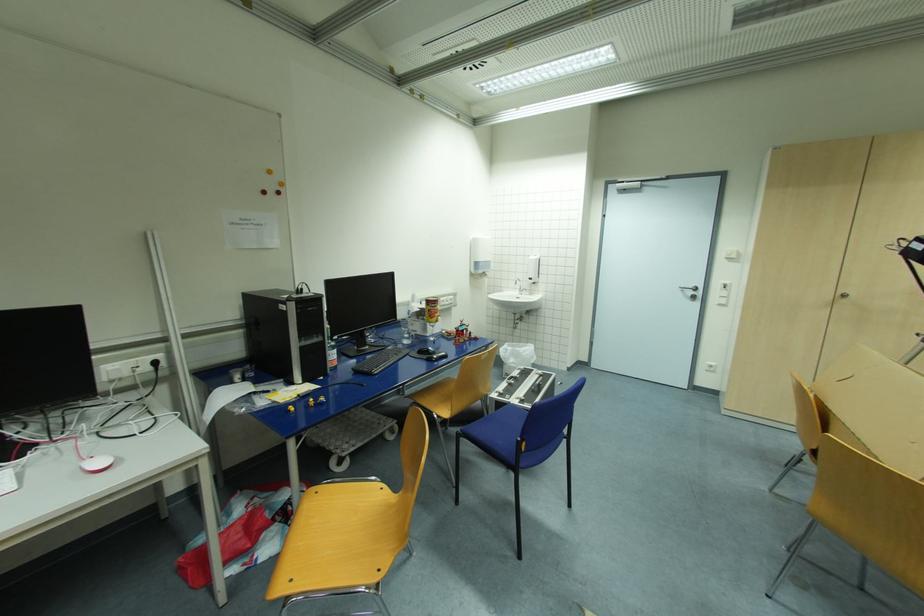
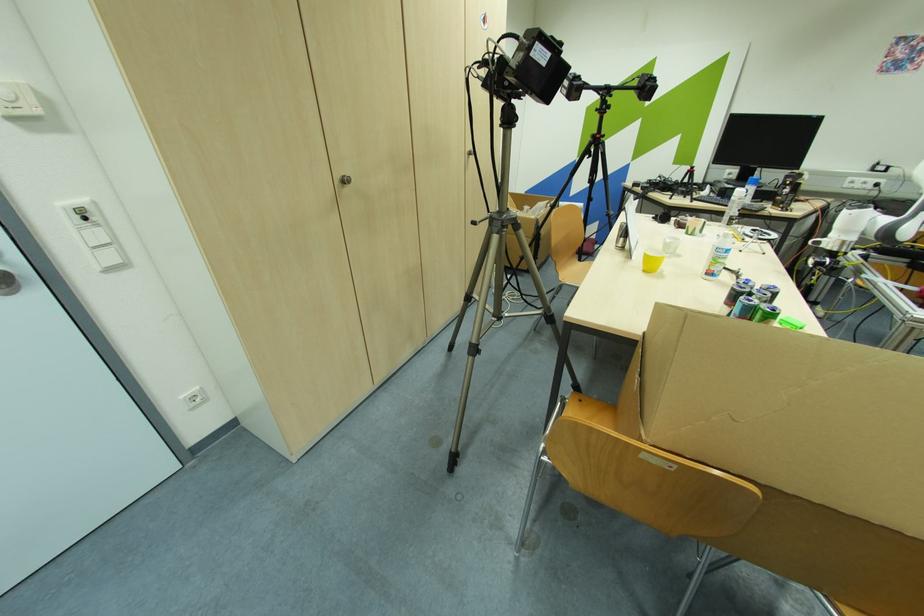
The point at (727,294) is marked in the first image. Where is the corresponding point in the second image?

(102, 236)